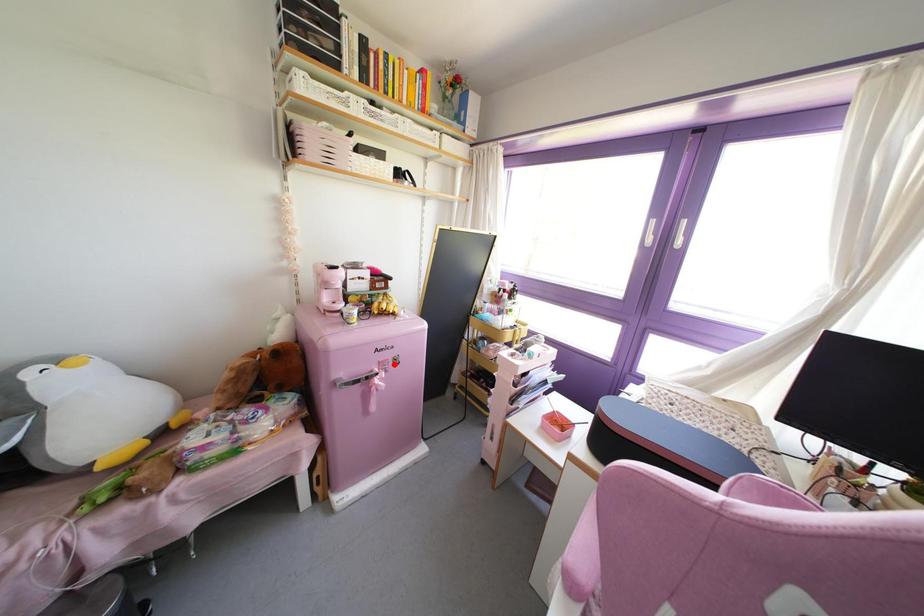
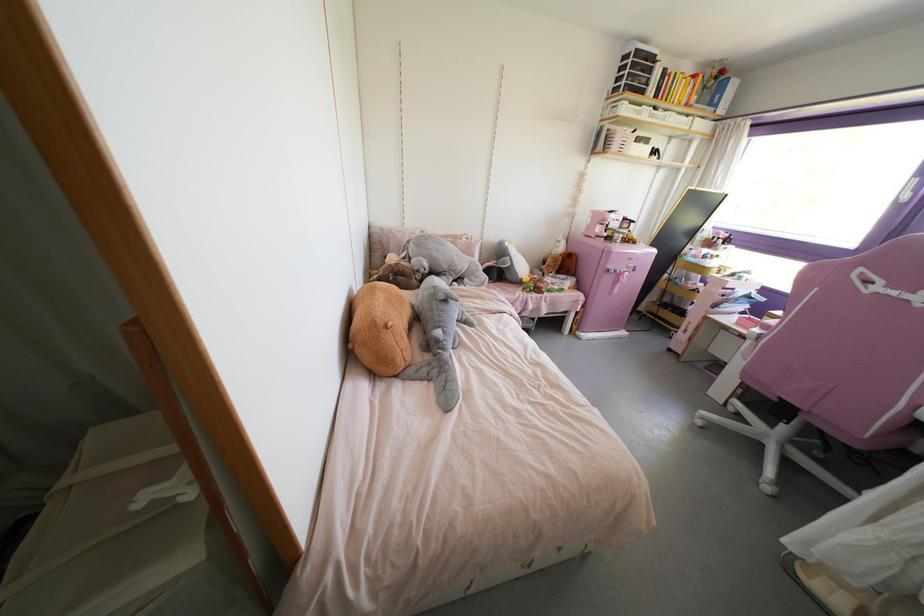
Find the pixel in the second image that matches the highlighted location in the first image.

(633, 270)